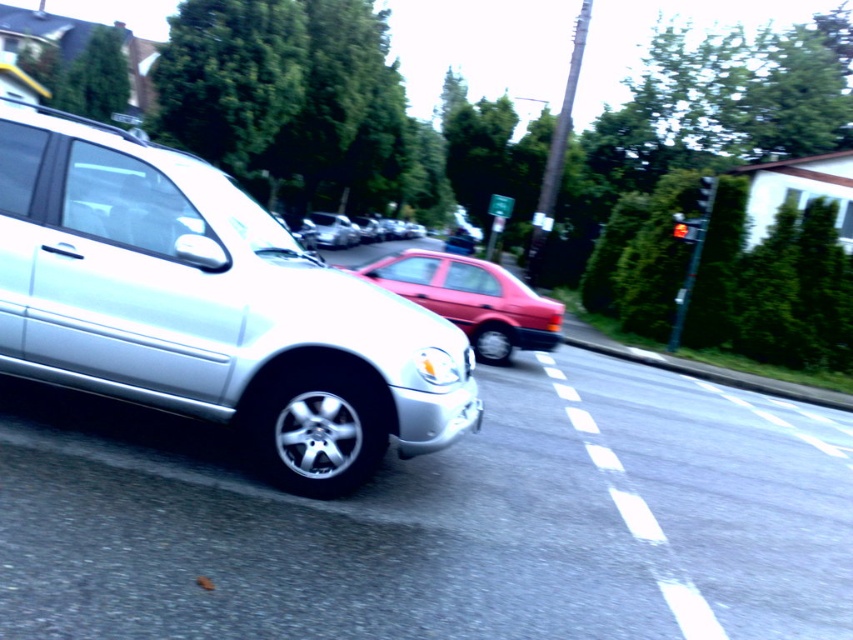
You are a delivery driver navigating a busy street. You see a satin silver minivan at left. Based on its position, can you estimate its location relative to the center of the image?

The satin silver minivan at left is located at point 0.483 on the x axis and 0.247 on the y axis, which places it slightly to the left and lower center of the image.

You are a delivery driver who needs to pass the shiny silver sedan at center while driving in the satin silver minivan at left. Given that your minivan is 16.5 feet long and the sedan is 14 feet long, can you safely overtake the sedan within the next 100 feet of road ahead?

The satin silver minivan at left and shiny silver sedan at center are 79.25 feet apart. With both vehicles moving, the minivan is 16.5 feet long and the sedan is 14 feet long, totaling 30.5 feet for both. Subtracting this from the 100 feet available gives 69.5 feet remaining. Since this distance is sufficient to complete the maneuver safely, yes, you can overtake the shiny silver sedan at center within the next 100 feet.

You are a delivery driver who needs to park your truck between the satin silver minivan at left and the matte red sedan at center. Given that your truck is 1.8 meters tall, can you safely park there without hitting the roof?

The satin silver minivan at left is taller than the matte red sedan at center. Since the minivan is taller, the available space between them might be constrained by its height. However, the description does not provide specific height measurements. Without knowing the exact height of the minivan or the clearance between the vehicles, it is impossible to determine if the 1.8 meter tall truck can safely park there.